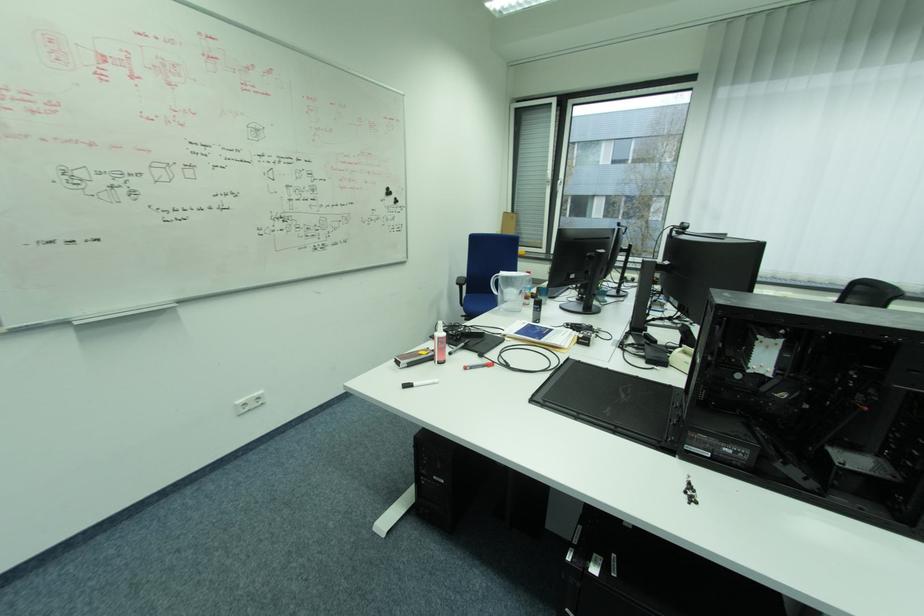
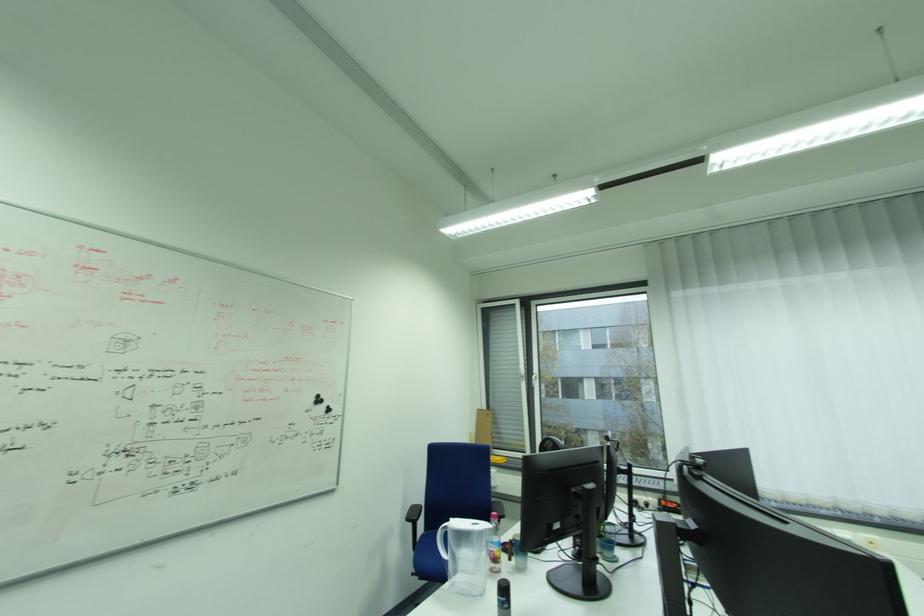
Find the pixel in the second image that matches point 465,285 in the first image.

(415, 521)